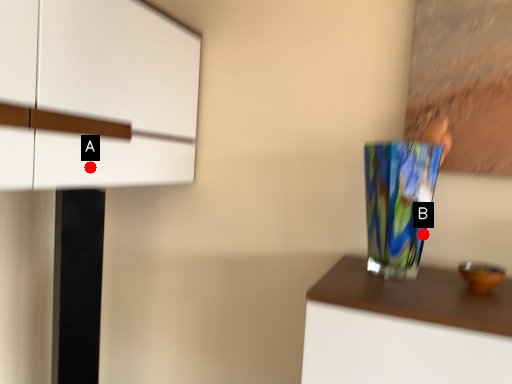
Question: Two points are circled on the image, labeled by A and B beside each circle. Which of the following is the closest to the observer?

Choices:
 (A) A is closer
 (B) B is closer

Answer: (A)